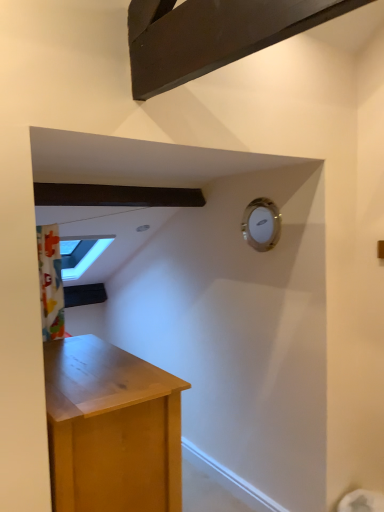
Describe the element at coordinates (261, 224) in the screenshot. The image size is (384, 512). I see `transparent glass gauge at upper right` at that location.

What is the approximate width of transparent glass gauge at upper right?

The width of transparent glass gauge at upper right is 1.63 inches.

Identify the location of transparent glass gauge at upper right. (261, 224).

Identify the location of transparent glass gauge at upper right. (261, 224).